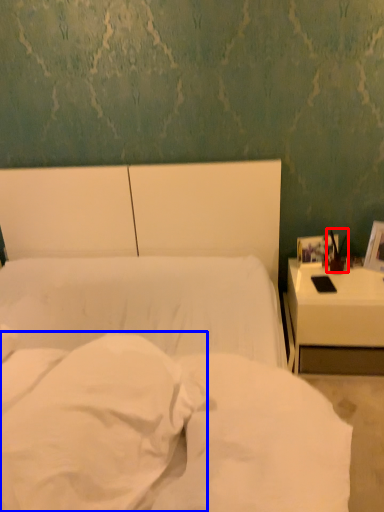
Question: Which object is further to the camera taking this photo, bedside lamp (highlighted by a red box) or pillow (highlighted by a blue box)?

Choices:
 (A) bedside lamp
 (B) pillow

Answer: (A)